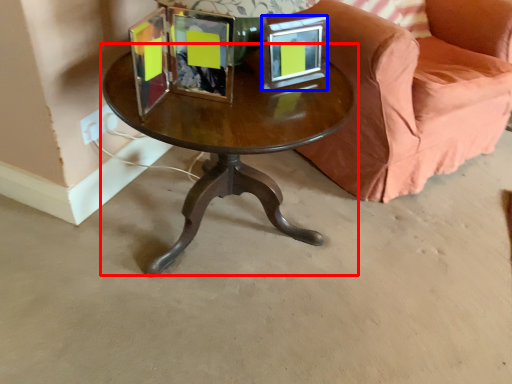
Question: Among these objects, which one is nearest to the camera, coffee table (highlighted by a red box) or picture frame (highlighted by a blue box)?

Choices:
 (A) coffee table
 (B) picture frame

Answer: (A)